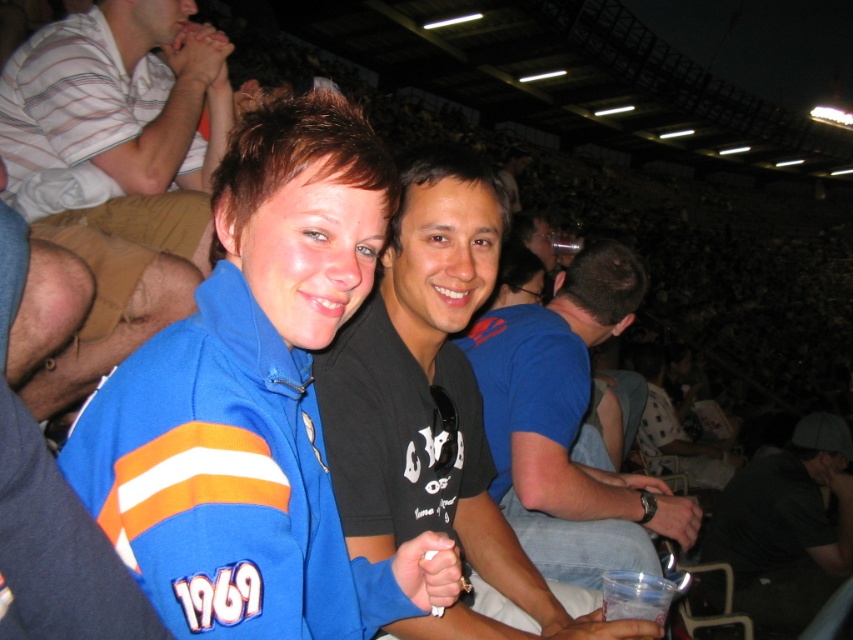
What is the color of the shirt at the point with coordinates (434,406)?

The point at coordinates (434,406) is on a black matte shirt at center.